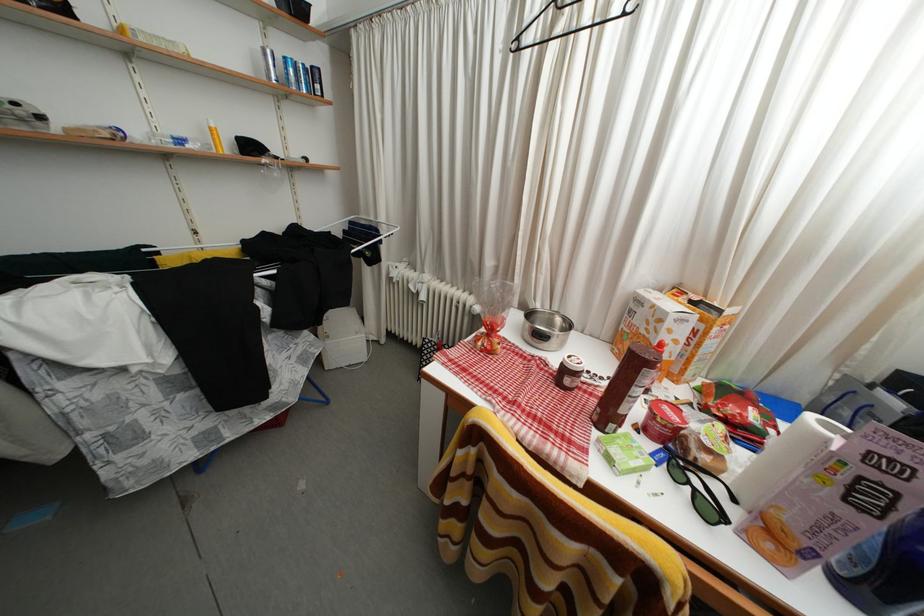
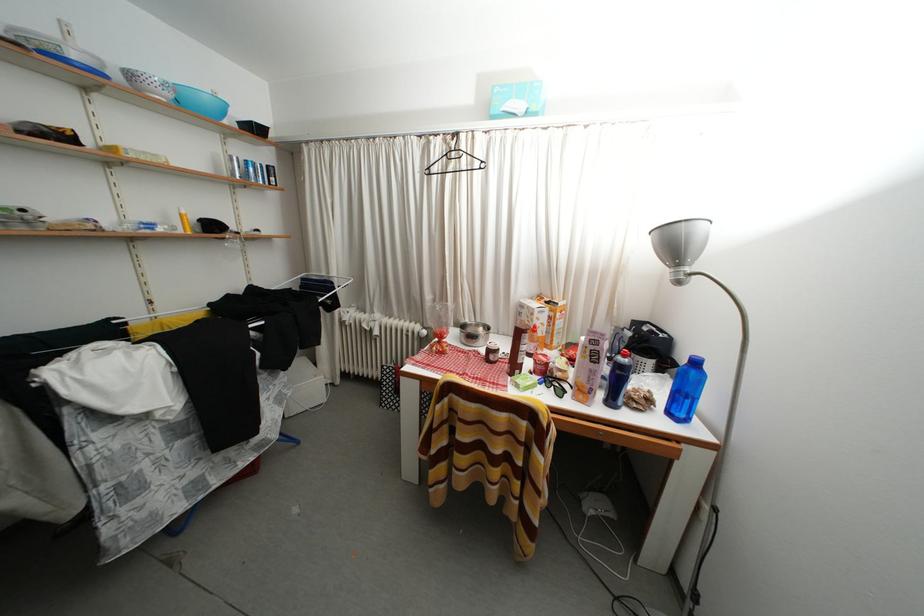
The point at (647,306) is marked in the first image. Where is the corresponding point in the second image?

(529, 310)